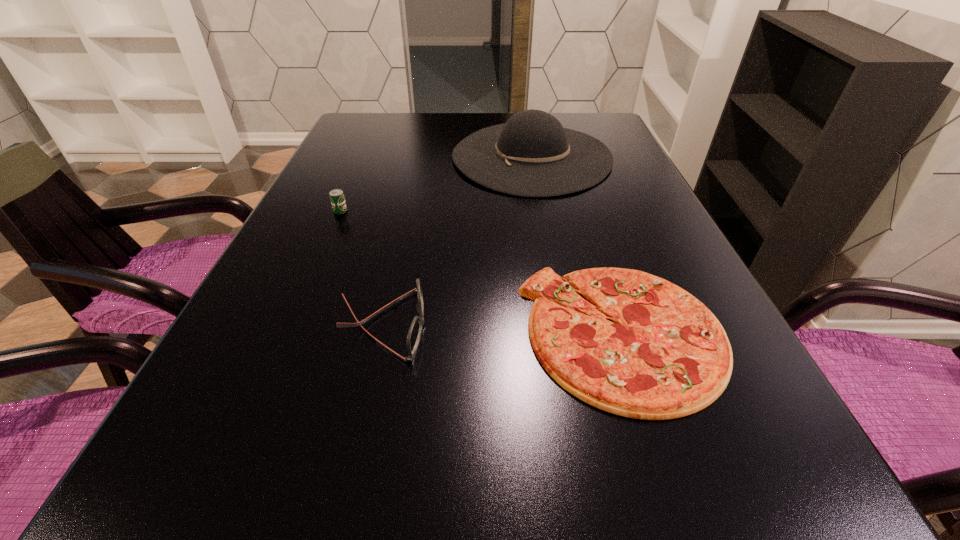
At what (x,y) coordinates should I click in order to perform the action: click on the tallest object. Please return your answer as a coordinate pair (x, y). The image size is (960, 540). Looking at the image, I should click on (531, 155).

Where is `beer can`? Image resolution: width=960 pixels, height=540 pixels. beer can is located at coordinates (337, 198).

You are a GUI agent. You are given a task and a screenshot of the screen. Output one action in this format:
    pyautogui.click(x=<x>, y=<y>)
    Task: Click on the spectacles
    The width and height of the screenshot is (960, 540).
    Given the screenshot: What is the action you would take?
    pyautogui.click(x=414, y=334)

Image resolution: width=960 pixels, height=540 pixels. Identify the location of the shortest object. (666, 356).

The width and height of the screenshot is (960, 540). Find the location of `free space located 0.060m on the front-facing side of the tallest object`. free space located 0.060m on the front-facing side of the tallest object is located at coordinates (430, 157).

The width and height of the screenshot is (960, 540). Find the location of `vacant space located 0.150m on the front-facing side of the tallest object`. vacant space located 0.150m on the front-facing side of the tallest object is located at coordinates (397, 157).

The image size is (960, 540). What are the coordinates of `free region located 0.180m on the front-facing side of the tallest object` in the screenshot? It's located at (386, 157).

Locate an element on the screen. The height and width of the screenshot is (540, 960). free space located on the right of the beer can is located at coordinates (387, 211).

The height and width of the screenshot is (540, 960). I want to click on vacant space located 0.300m on the front-facing side of the third object from right to left, so click(x=604, y=325).

The height and width of the screenshot is (540, 960). I want to click on free spot located on the left of the shortest object, so click(491, 333).